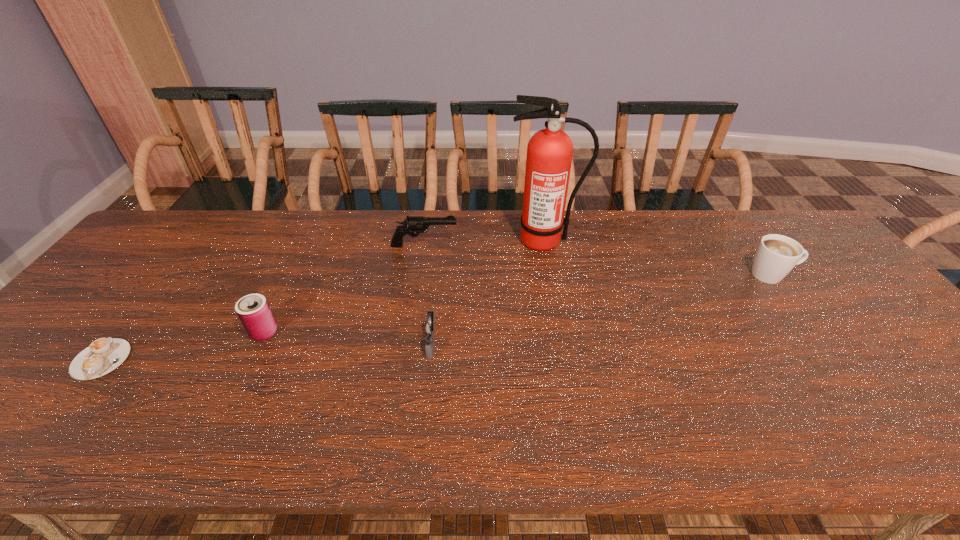
You are a GUI agent. You are given a task and a screenshot of the screen. Output one action in this format:
    pyautogui.click(x=<x>, y=<y>)
    Task: Click on the free location at the near edge of the desktop
    
    Given the screenshot: What is the action you would take?
    pyautogui.click(x=273, y=419)

In the image, there is a desktop. Identify the location of vacant space at the left edge. The image size is (960, 540). (100, 328).

You are a GUI agent. You are given a task and a screenshot of the screen. Output one action in this format:
    pyautogui.click(x=<x>, y=<y>)
    Task: Click on the free space at the right edge of the desktop
    The height and width of the screenshot is (540, 960).
    Given the screenshot: What is the action you would take?
    pyautogui.click(x=878, y=364)

In the image, there is a desktop. Where is `free region at the far left corner`? free region at the far left corner is located at coordinates (146, 239).

In the image, there is a desktop. What are the coordinates of `vacant region at the far right corner` in the screenshot? It's located at (756, 226).

Locate an element on the screen. This screenshot has width=960, height=540. free space between the rightmost object and the second object from right to left is located at coordinates (659, 258).

I want to click on unoccupied position between the fifth object from left to right and the igniter, so click(489, 292).

Image resolution: width=960 pixels, height=540 pixels. I want to click on free space between the second object from left to right and the nearer cappuccino, so click(x=182, y=346).

Find the location of a particular element. blank region between the tallest object and the igniter is located at coordinates (489, 292).

Identify the location of vacant region between the gun and the second object from left to right. (345, 289).